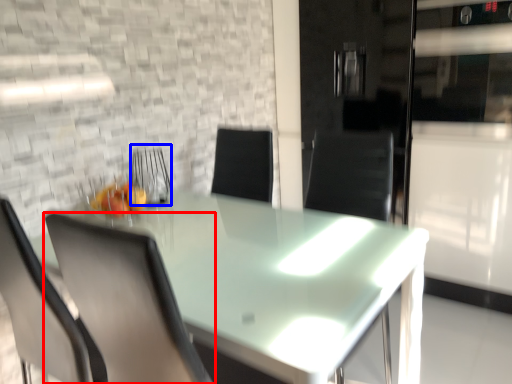
Question: Which point is closer to the camera, chair (highlighted by a red box) or armchair (highlighted by a blue box)?

Choices:
 (A) chair
 (B) armchair

Answer: (A)